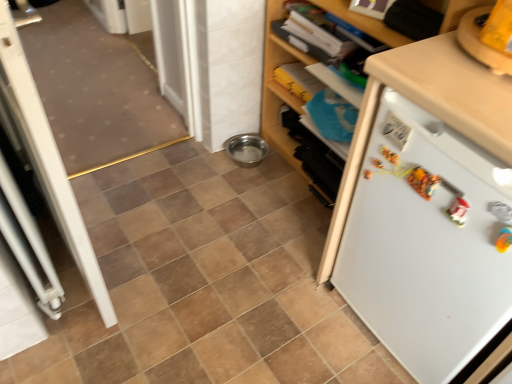
Question: From the image's perspective, would you say brown matte tile at center is shown under white matte refrigerator at right?

Choices:
 (A) yes
 (B) no

Answer: (A)

Question: From a real-world perspective, does brown matte tile at center stand above white matte refrigerator at right?

Choices:
 (A) yes
 (B) no

Answer: (B)

Question: Is brown matte tile at center not inside white matte refrigerator at right?

Choices:
 (A) no
 (B) yes

Answer: (B)

Question: Is brown matte tile at center to the right of white matte refrigerator at right from the viewer's perspective?

Choices:
 (A) yes
 (B) no

Answer: (B)

Question: Is brown matte tile at center not near white matte refrigerator at right?

Choices:
 (A) yes
 (B) no

Answer: (B)

Question: Is white matte refrigerator at right located within brown matte tile at center?

Choices:
 (A) no
 (B) yes

Answer: (A)

Question: Can white matte cabinet at upper right be found inside brown matte tile at center?

Choices:
 (A) yes
 (B) no

Answer: (B)

Question: From the image's perspective, is brown matte tile at center below white matte cabinet at upper right?

Choices:
 (A) yes
 (B) no

Answer: (A)

Question: From the image's perspective, is brown matte tile at center on top of white matte cabinet at upper right?

Choices:
 (A) yes
 (B) no

Answer: (B)

Question: Does brown matte tile at center have a lesser height compared to white matte cabinet at upper right?

Choices:
 (A) no
 (B) yes

Answer: (B)

Question: Is brown matte tile at center bigger than white matte cabinet at upper right?

Choices:
 (A) no
 (B) yes

Answer: (A)

Question: Is brown matte tile at center facing away from white matte cabinet at upper right?

Choices:
 (A) yes
 (B) no

Answer: (B)

Question: Considering the relative sizes of white matte cabinet at upper right and white plastic screen door at left in the image provided, is white matte cabinet at upper right wider than white plastic screen door at left?

Choices:
 (A) no
 (B) yes

Answer: (B)